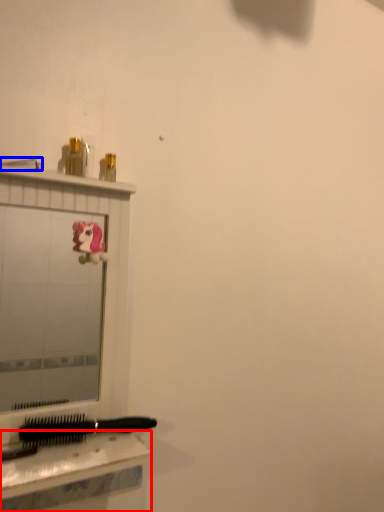
Question: Which of the following is the farthest to the observer, table (highlighted by a red box) or shower (highlighted by a blue box)?

Choices:
 (A) table
 (B) shower

Answer: (B)